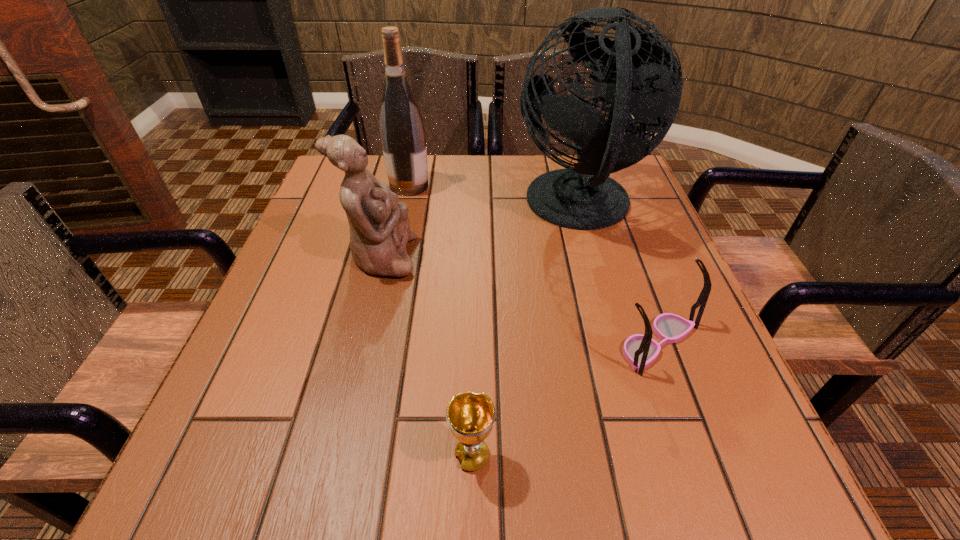
Find the location of a particular element. Image resolution: width=960 pixels, height=540 pixels. free spot between the figurine and the fourth farthest object is located at coordinates (519, 300).

You are a GUI agent. You are given a task and a screenshot of the screen. Output one action in this format:
    pyautogui.click(x=<x>, y=<y>)
    Task: Click on the empty location between the globe and the third shortest object
    This screenshot has height=540, width=960.
    Given the screenshot: What is the action you would take?
    pyautogui.click(x=480, y=232)

This screenshot has height=540, width=960. I want to click on free space between the spectacles and the figurine, so click(519, 300).

Identify the location of vacant area between the fourth shortest object and the globe. (494, 197).

Locate which object ranks third in proximity to the globe. Please provide its 2D coordinates. Your answer should be formatted as a tuple, i.e. [(x, y)], where the tuple contains the x and y coordinates of a point satisfying the conditions above.

[(379, 226)]

Identify which object is the second closest to the globe. Please provide its 2D coordinates. Your answer should be formatted as a tuple, i.e. [(x, y)], where the tuple contains the x and y coordinates of a point satisfying the conditions above.

[(402, 131)]

At what (x,y) coordinates should I click in order to perform the action: click on free space that satisfies the following two spatial constraints: 1. on the label of the fourth shortest object; 2. on the right side of the fourth farthest object. Please return your answer as a coordinate pair (x, y). The width and height of the screenshot is (960, 540). Looking at the image, I should click on (376, 342).

Locate an element on the screen. This screenshot has height=540, width=960. free space that satisfies the following two spatial constraints: 1. on the front-facing side of the spectacles; 2. on the left side of the third shortest object is located at coordinates (361, 342).

Locate an element on the screen. The width and height of the screenshot is (960, 540). vacant space that satisfies the following two spatial constraints: 1. on the front-facing side of the figurine; 2. on the back side of the spectacles is located at coordinates pyautogui.click(x=361, y=342).

You are a GUI agent. You are given a task and a screenshot of the screen. Output one action in this format:
    pyautogui.click(x=<x>, y=<y>)
    Task: Click on the vacant region that satisfies the following two spatial constraints: 1. on the back side of the third object from right to left; 2. on the label of the wine bottle
    The width and height of the screenshot is (960, 540).
    Given the screenshot: What is the action you would take?
    pyautogui.click(x=475, y=186)